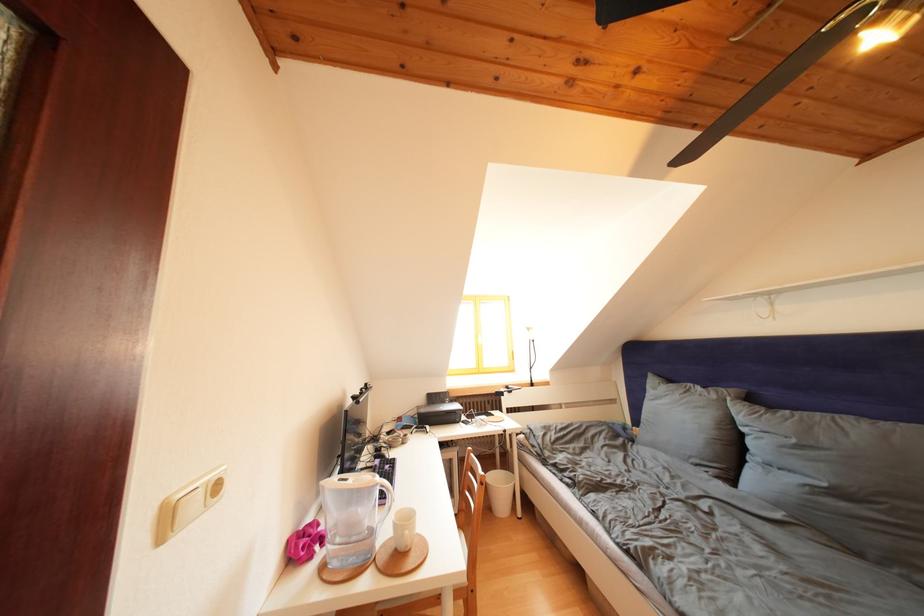
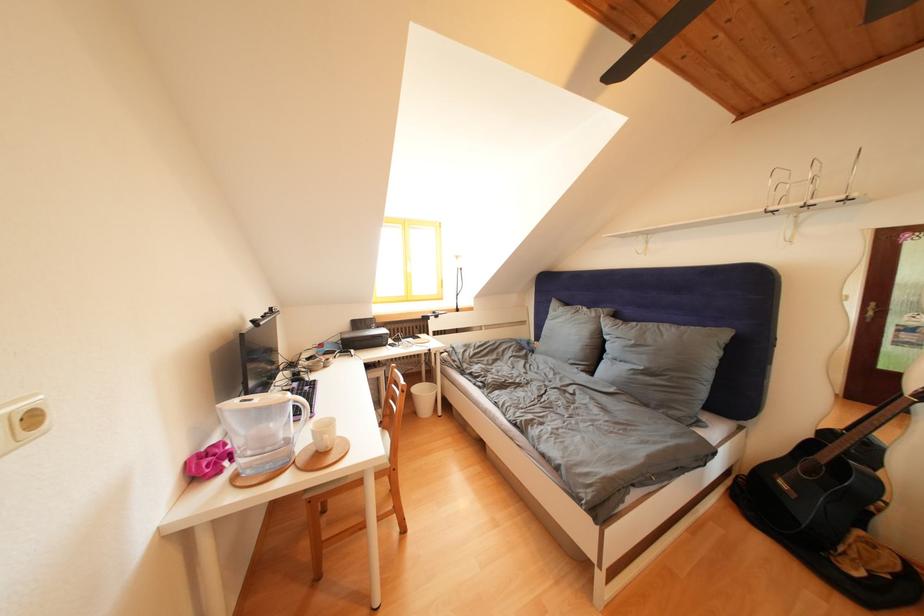
The point at (722, 402) is marked in the first image. Where is the corresponding point in the second image?

(602, 320)